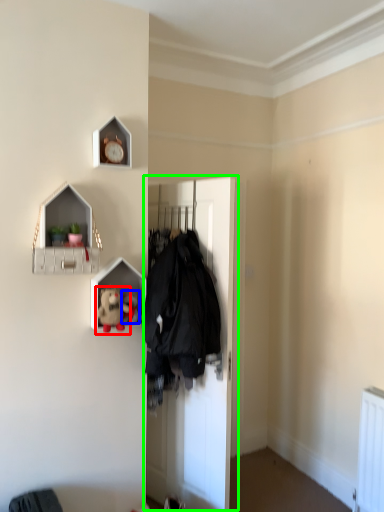
Question: Estimate the real-world distances between objects in this image. Which object is closer to toy (highlighted by a red box), toy (highlighted by a blue box) or door (highlighted by a green box)?

Choices:
 (A) toy
 (B) door

Answer: (A)